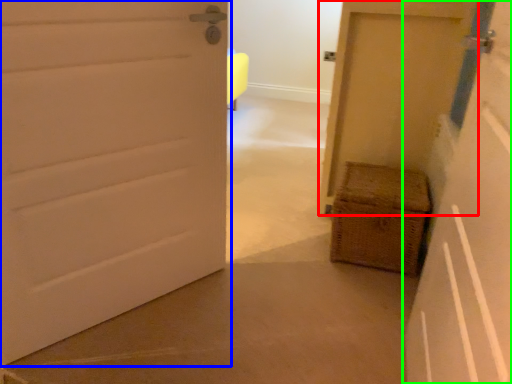
Question: Based on their relative distances, which object is nearer to door (highlighted by a red box)? Choose from door (highlighted by a blue box) and door (highlighted by a green box).

Choices:
 (A) door
 (B) door

Answer: (B)